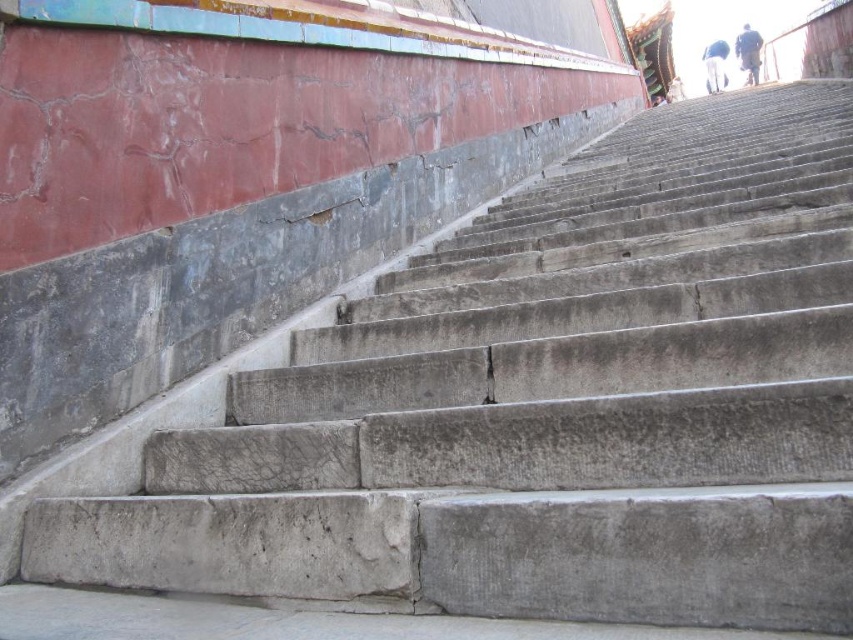
You are standing at the bottom of the stone steps leading upwards and notice the brown leather pants at upper right. Based on their position, can you estimate whether they are closer to the top of the steps or the bottom?

The brown leather pants at upper right are located at point (747, 51), which places them closer to the top of the steps rather than the bottom.

You are standing at the bottom of the stone steps and see the brown leather pants at upper right and the white cotton pants at upper right. Which one is closer to you?

The brown leather pants at upper right is in front of the white cotton pants at upper right, so it is closer to you.